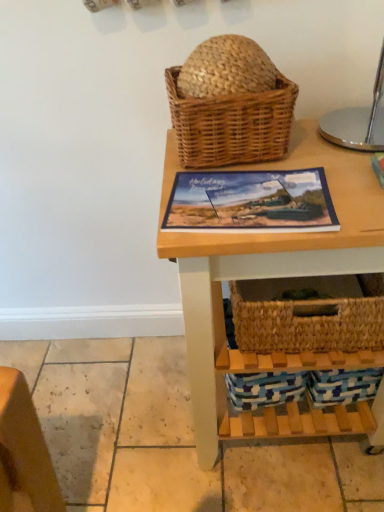
The image size is (384, 512). Find the location of `free spot above natural wood table at center (from a real-world perspective)`. free spot above natural wood table at center (from a real-world perspective) is located at coordinates (280, 174).